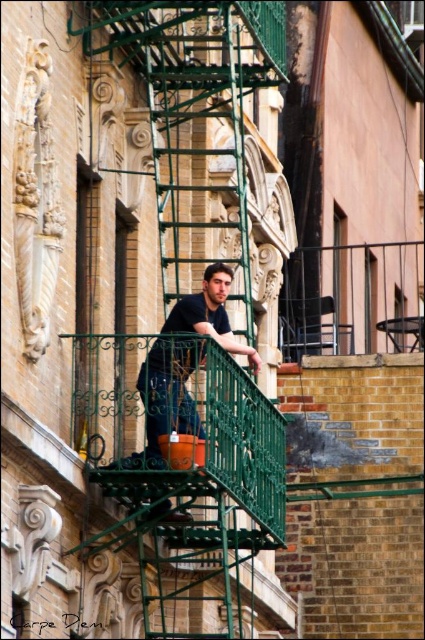
Question: Which point appears closest to the camera in this image?

Choices:
 (A) (141, 461)
 (B) (269, 445)

Answer: (A)

Question: Which point is farther from the camera taking this photo?

Choices:
 (A) (164, 403)
 (B) (150, 566)

Answer: (B)

Question: Which of the following is the closest to the observer?

Choices:
 (A) (113, 340)
 (B) (113, 461)

Answer: (B)

Question: Can you confirm if green metal fire escape at center is positioned to the right of dark blue shirt at center?

Choices:
 (A) yes
 (B) no

Answer: (A)

Question: In this image, where is green metal fire escape at center located relative to dark blue shirt at center?

Choices:
 (A) above
 (B) below

Answer: (B)

Question: Is green metal fire escape at center further to the viewer compared to dark blue shirt at center?

Choices:
 (A) no
 (B) yes

Answer: (A)